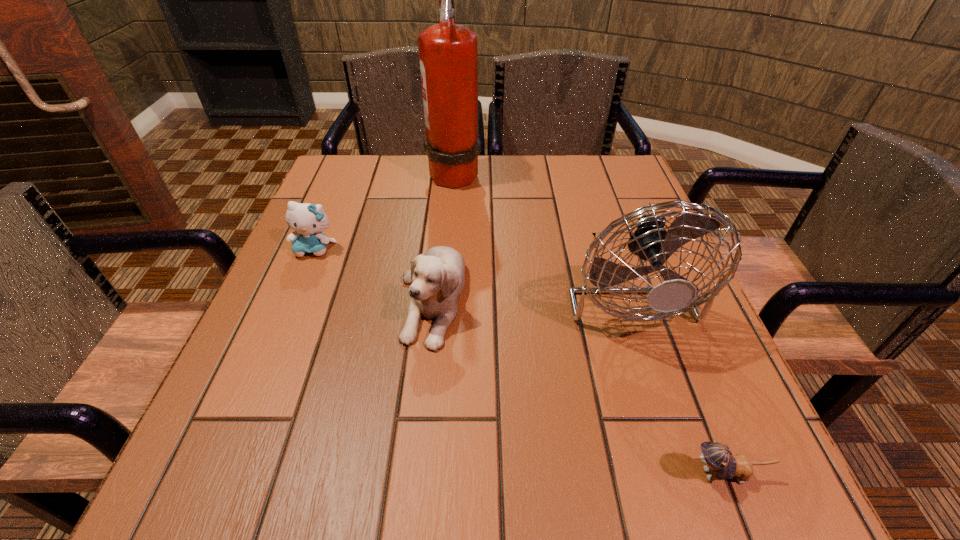
Where is `vacant region that satisfies the following two spatial constraints: 1. at the nozzle of the tallest object; 2. on the face of the leftmost object`? vacant region that satisfies the following two spatial constraints: 1. at the nozzle of the tallest object; 2. on the face of the leftmost object is located at coordinates (448, 249).

The height and width of the screenshot is (540, 960). What are the coordinates of `free space that satisfies the following two spatial constraints: 1. at the nozzle of the tallest object; 2. on the face of the leftmost object` in the screenshot? It's located at (448, 249).

This screenshot has height=540, width=960. What are the coordinates of `vacant space that satisfies the following two spatial constraints: 1. at the nozzle of the farthest object; 2. on the front-facing side of the puppy` in the screenshot? It's located at (444, 298).